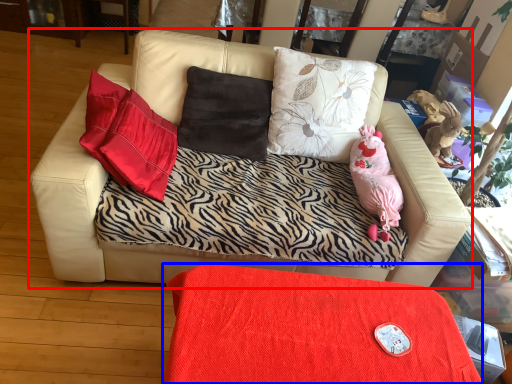
Question: Which of the following is the closest to the observer, studio couch (highlighted by a red box) or table (highlighted by a blue box)?

Choices:
 (A) studio couch
 (B) table

Answer: (B)